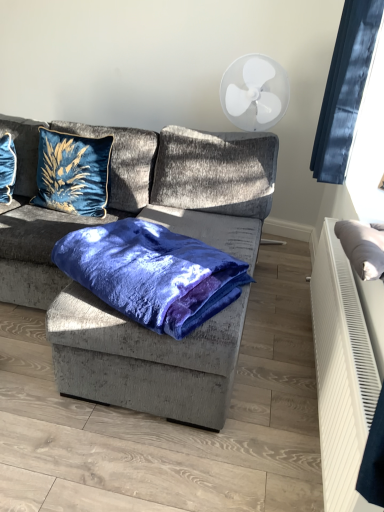
Question: Considering the relative sizes of velvet blue blanket at center and gray fabric pillow at right, which ranks as the 1th pillow in front-to-back order, in the image provided, is velvet blue blanket at center thinner than gray fabric pillow at right, which ranks as the 1th pillow in front-to-back order,?

Choices:
 (A) no
 (B) yes

Answer: (A)

Question: From the image's perspective, is velvet blue blanket at center on gray fabric pillow at right, the 1th pillow positioned from the right?

Choices:
 (A) no
 (B) yes

Answer: (A)

Question: Is gray fabric pillow at right, which ranks as the 1th pillow in front-to-back order, inside velvet blue blanket at center?

Choices:
 (A) yes
 (B) no

Answer: (B)

Question: From the image's perspective, is velvet blue blanket at center located beneath gray fabric pillow at right, which appears as the third pillow when viewed from the back?

Choices:
 (A) no
 (B) yes

Answer: (B)

Question: Is velvet blue blanket at center shorter than gray fabric pillow at right, which appears as the third pillow when viewed from the back?

Choices:
 (A) yes
 (B) no

Answer: (B)

Question: Looking at their shapes, would you say gray fabric pillow at right, which ranks as the 3th pillow in left-to-right order, is wider or thinner than velvet blue pillow at upper left, which is counted as the 3th pillow, starting from the front?

Choices:
 (A) wide
 (B) thin

Answer: (B)

Question: Do you think gray fabric pillow at right, which appears as the third pillow when viewed from the back, is within velvet blue pillow at upper left, which is counted as the 3th pillow, starting from the front, or outside of it?

Choices:
 (A) outside
 (B) inside

Answer: (A)

Question: In terms of height, does gray fabric pillow at right, which appears as the third pillow when viewed from the back, look taller or shorter compared to velvet blue pillow at upper left, which is counted as the 3th pillow, starting from the front?

Choices:
 (A) tall
 (B) short

Answer: (B)

Question: From the image's perspective, relative to velvet blue pillow at upper left, which is counted as the 3th pillow, starting from the front, is gray fabric pillow at right, which ranks as the 1th pillow in front-to-back order, above or below?

Choices:
 (A) below
 (B) above

Answer: (A)

Question: From the image's perspective, is velvet grey couch at center positioned above or below black fabric at upper right?

Choices:
 (A) above
 (B) below

Answer: (B)

Question: Is point (170, 145) closer or farther from the camera than point (342, 124)?

Choices:
 (A) closer
 (B) farther

Answer: (B)

Question: From a real-world perspective, relative to black fabric at upper right, is velvet grey couch at center vertically above or below?

Choices:
 (A) below
 (B) above

Answer: (A)

Question: In terms of width, does velvet grey couch at center look wider or thinner when compared to black fabric at upper right?

Choices:
 (A) thin
 (B) wide

Answer: (B)

Question: From a real-world perspective, is velvet blue pillow at upper left, acting as the 2th pillow starting from the front, positioned above or below velvet blue pillow at upper left, positioned as the 1th pillow in back-to-front order?

Choices:
 (A) below
 (B) above

Answer: (B)

Question: In terms of height, does velvet blue pillow at upper left, positioned as the 2th pillow in left-to-right order, look taller or shorter compared to velvet blue pillow at upper left, which is the 3th pillow from right to left?

Choices:
 (A) short
 (B) tall

Answer: (B)